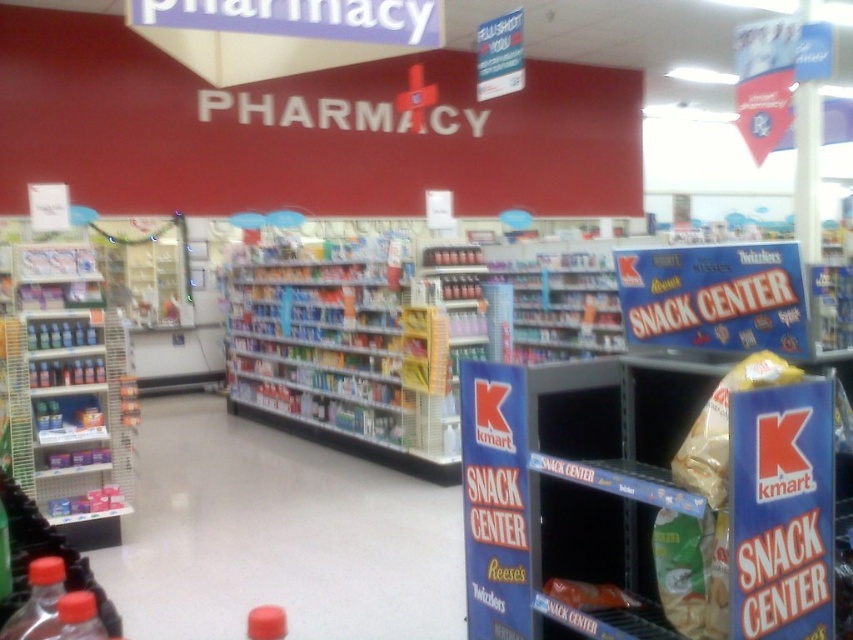
Question: Can you confirm if matte plastic shelves at left is bigger than matte plastic candy at center?

Choices:
 (A) yes
 (B) no

Answer: (A)

Question: Among these objects, which one is farthest from the camera?

Choices:
 (A) blue cardboard snack center at lower right
 (B) translucent plastic bottle at lower left
 (C) matte plastic shelves at left

Answer: (C)

Question: Which point appears closest to the camera in this image?

Choices:
 (A) pyautogui.click(x=538, y=376)
 (B) pyautogui.click(x=38, y=580)

Answer: (B)

Question: Is matte plastic shelves at left above yellow matte snack bag at center right?

Choices:
 (A) no
 (B) yes

Answer: (A)

Question: Is translucent plastic bottle at lower left above matte plastic candy at center?

Choices:
 (A) yes
 (B) no

Answer: (A)

Question: Which point is farther from the camera taking this photo?

Choices:
 (A) (22, 380)
 (B) (577, 600)
 (C) (700, 401)

Answer: (A)